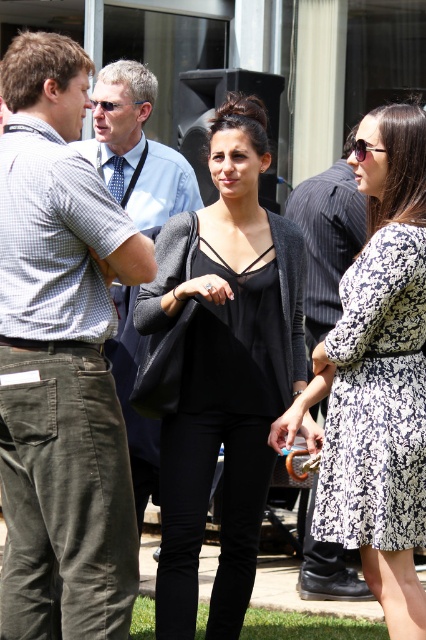
Is light blue shirt at center taller than shiny black sunglasses at upper right?

Yes.

Is point (104, 164) closer to viewer compared to point (377, 148)?

No, (104, 164) is further to viewer.

Identify the location of light blue shirt at center. (137, 150).

Can you confirm if light blue shirt at center is positioned to the right of black pinstripe shirt at center?

In fact, light blue shirt at center is to the left of black pinstripe shirt at center.

I want to click on light blue shirt at center, so click(137, 150).

Locate an element on the screen. The image size is (426, 640). light blue shirt at center is located at coordinates (137, 150).

Which is more to the right, black matte/black textured top at center or light blue shirt at center?

black matte/black textured top at center

Consider the image. Is black matte/black textured top at center thinner than light blue shirt at center?

No, black matte/black textured top at center is not thinner than light blue shirt at center.

In the scene shown: Who is more distant from viewer, [264,369] or [111,180]?

The point [111,180] is behind.

This screenshot has height=640, width=426. I want to click on black matte/black textured top at center, so click(x=224, y=371).